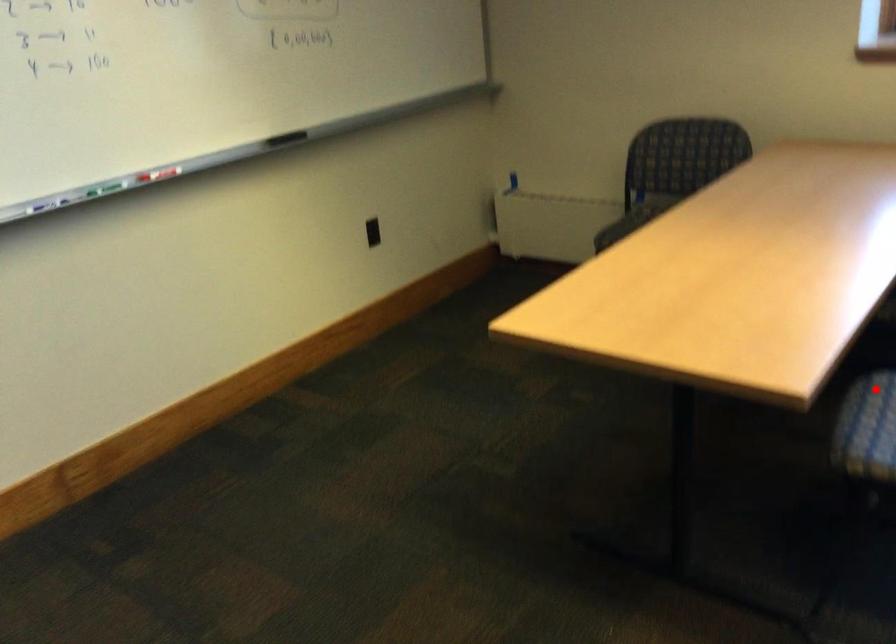
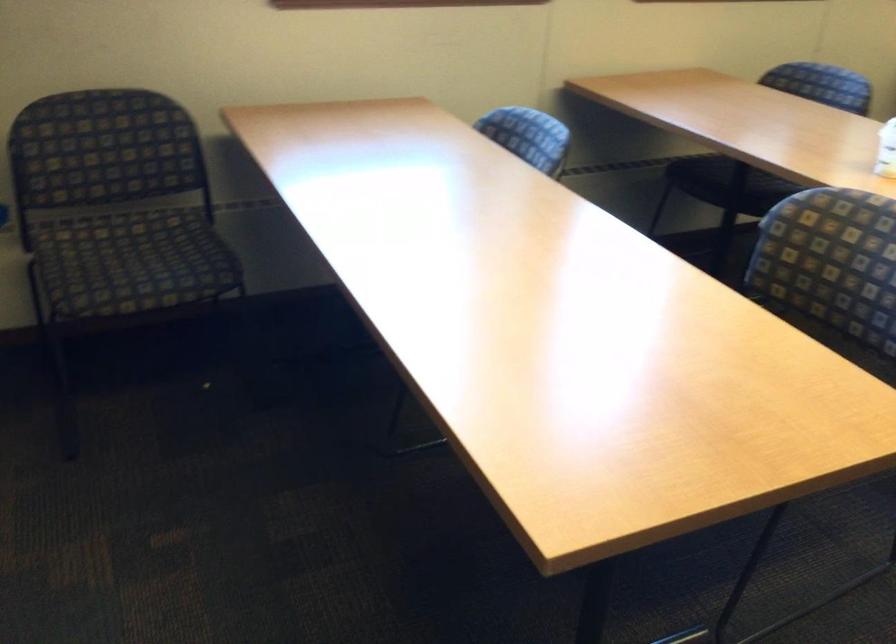
Question: I am providing you with two images of the same scene from different viewpoints. A red point is marked on the first image. At the location where the point appears in image 1, is it still visible in image 2?

Choices:
 (A) Yes
 (B) No

Answer: (B)